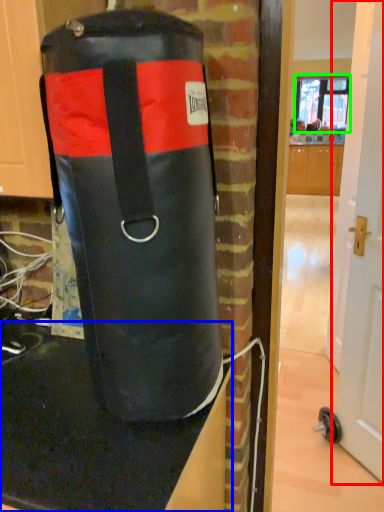
Question: Which is farther away from door (highlighted by a red box)? table top (highlighted by a blue box) or window screen (highlighted by a green box)?

Choices:
 (A) table top
 (B) window screen

Answer: (B)